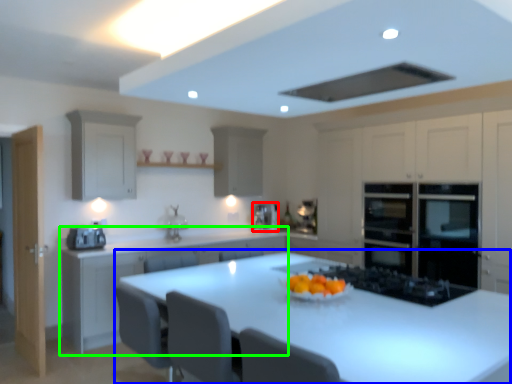
Question: Considering the real-world distances, which object is farthest from coffee machine (highlighted by a red box)? table (highlighted by a blue box) or cabinetry (highlighted by a green box)?

Choices:
 (A) table
 (B) cabinetry

Answer: (A)